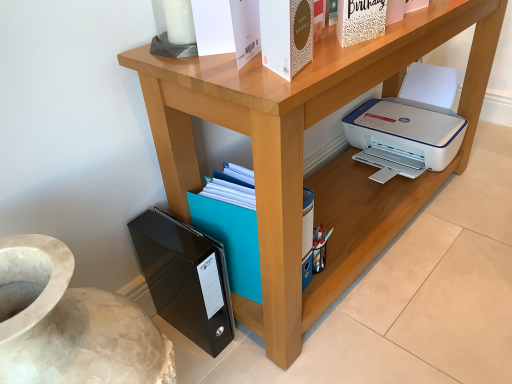
Question: Could you tell me if black glossy file folder at lower left, the third paperback book viewed from the right, is turned towards gold textured paper at upper center, arranged as the third paperback book when viewed from the back?

Choices:
 (A) no
 (B) yes

Answer: (A)

Question: Is black glossy file folder at lower left, which appears as the 3th paperback book when viewed from the top, in contact with gold textured paper at upper center, the 2th paperback book from the bottom?

Choices:
 (A) no
 (B) yes

Answer: (A)

Question: Is black glossy file folder at lower left, which ranks as the 1th paperback book in back-to-front order, oriented away from gold textured paper at upper center, arranged as the third paperback book when viewed from the back?

Choices:
 (A) yes
 (B) no

Answer: (B)

Question: Considering the relative sizes of black glossy file folder at lower left, which appears as the first paperback book when viewed from the left, and gold textured paper at upper center, which appears as the 2th paperback book when viewed from the left, in the image provided, is black glossy file folder at lower left, which appears as the first paperback book when viewed from the left, wider than gold textured paper at upper center, which appears as the 2th paperback book when viewed from the left,?

Choices:
 (A) no
 (B) yes

Answer: (B)

Question: From the image's perspective, would you say black glossy file folder at lower left, the first paperback book in the bottom-to-top sequence, is positioned over gold textured paper at upper center, which ranks as the 2th paperback book in top-to-bottom order?

Choices:
 (A) yes
 (B) no

Answer: (B)

Question: Considering the positions of black glossy file folder at lower left, which appears as the first paperback book when viewed from the left, and gold textured paper at upper center, the 2th paperback book from the bottom, in the image, is black glossy file folder at lower left, which appears as the first paperback book when viewed from the left, taller or shorter than gold textured paper at upper center, the 2th paperback book from the bottom,?

Choices:
 (A) tall
 (B) short

Answer: (A)

Question: Which is correct: black glossy file folder at lower left, the first paperback book in the bottom-to-top sequence, is inside gold textured paper at upper center, which ranks as the 2th paperback book in top-to-bottom order, or outside of it?

Choices:
 (A) inside
 (B) outside

Answer: (B)

Question: Is point (222, 319) positioned closer to the camera than point (289, 76)?

Choices:
 (A) closer
 (B) farther

Answer: (B)

Question: Based on their positions, is black glossy file folder at lower left, which appears as the 3th paperback book when viewed from the top, located to the left or right of gold textured paper at upper center, arranged as the third paperback book when viewed from the back?

Choices:
 (A) right
 (B) left

Answer: (B)

Question: From a real-world perspective, is white textured paper at upper center, which is counted as the 3th paperback book, starting from the bottom, physically located above or below wooden printer at lower right?

Choices:
 (A) above
 (B) below

Answer: (A)

Question: Looking at their shapes, would you say white textured paper at upper center, which ranks as the 3th paperback book in left-to-right order, is wider or thinner than wooden printer at lower right?

Choices:
 (A) wide
 (B) thin

Answer: (B)

Question: Is white textured paper at upper center, the second paperback book in the back-to-front sequence, bigger or smaller than wooden printer at lower right?

Choices:
 (A) small
 (B) big

Answer: (A)

Question: Based on their positions, is white textured paper at upper center, the second paperback book in the back-to-front sequence, located to the left or right of wooden printer at lower right?

Choices:
 (A) left
 (B) right

Answer: (A)

Question: Considering the relative positions of black glossy file folder at lower left, which ranks as the 1th paperback book in back-to-front order, and wooden printer at lower right in the image provided, is black glossy file folder at lower left, which ranks as the 1th paperback book in back-to-front order, to the left or to the right of wooden printer at lower right?

Choices:
 (A) right
 (B) left

Answer: (B)

Question: Is point (181, 306) closer or farther from the camera than point (180, 185)?

Choices:
 (A) farther
 (B) closer

Answer: (A)